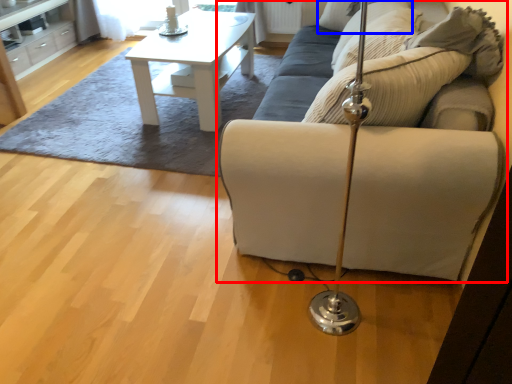
Question: Among these objects, which one is nearest to the camera, studio couch (highlighted by a red box) or pillow (highlighted by a blue box)?

Choices:
 (A) studio couch
 (B) pillow

Answer: (A)